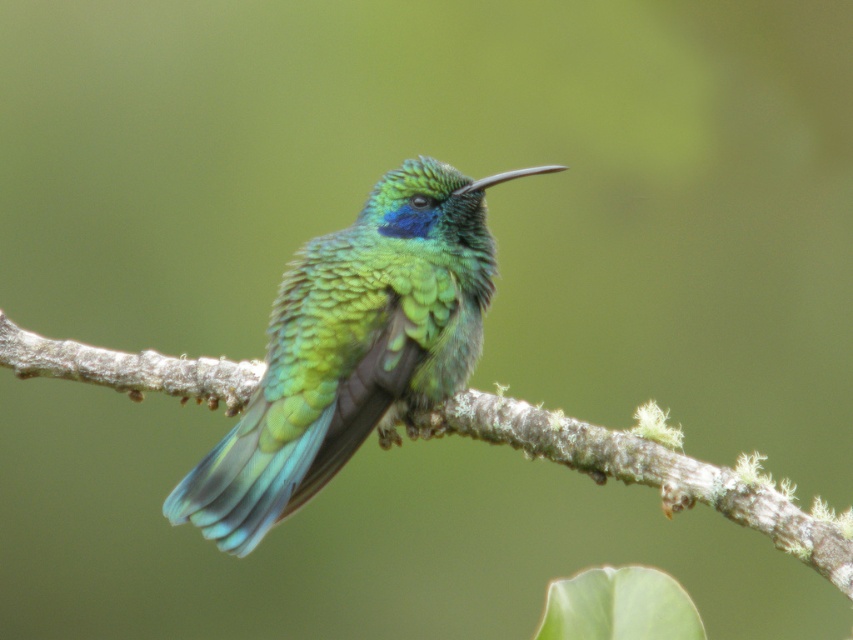
Question: Can you confirm if shiny green hummingbird at center is bigger than brown rough tree branch at center?

Choices:
 (A) no
 (B) yes

Answer: (B)

Question: Which point is farther from the camera taking this photo?

Choices:
 (A) tap(300, 358)
 (B) tap(140, 390)

Answer: (B)

Question: Which of the following is the farthest from the observer?

Choices:
 (A) shiny green hummingbird at center
 (B) brown rough tree branch at center

Answer: (A)

Question: Is shiny green hummingbird at center thinner than brown rough tree branch at center?

Choices:
 (A) no
 (B) yes

Answer: (A)

Question: Which object is farther from the camera taking this photo?

Choices:
 (A) shiny green hummingbird at center
 (B) brown rough tree branch at center

Answer: (A)

Question: Can you confirm if shiny green hummingbird at center is bigger than brown rough tree branch at center?

Choices:
 (A) yes
 (B) no

Answer: (A)